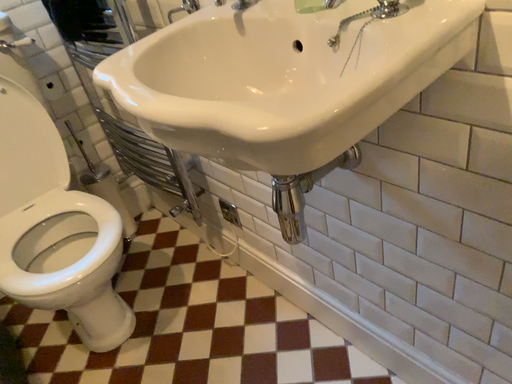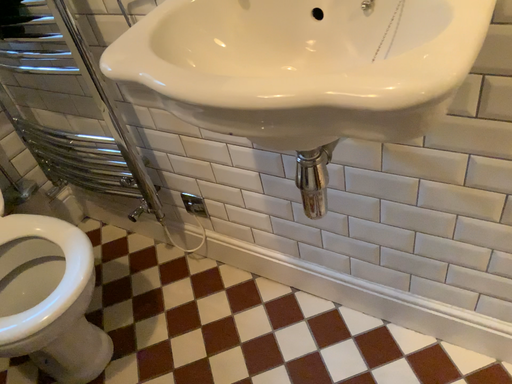
Question: How did the camera likely rotate when shooting the video?

Choices:
 (A) rotated right
 (B) rotated left

Answer: (A)